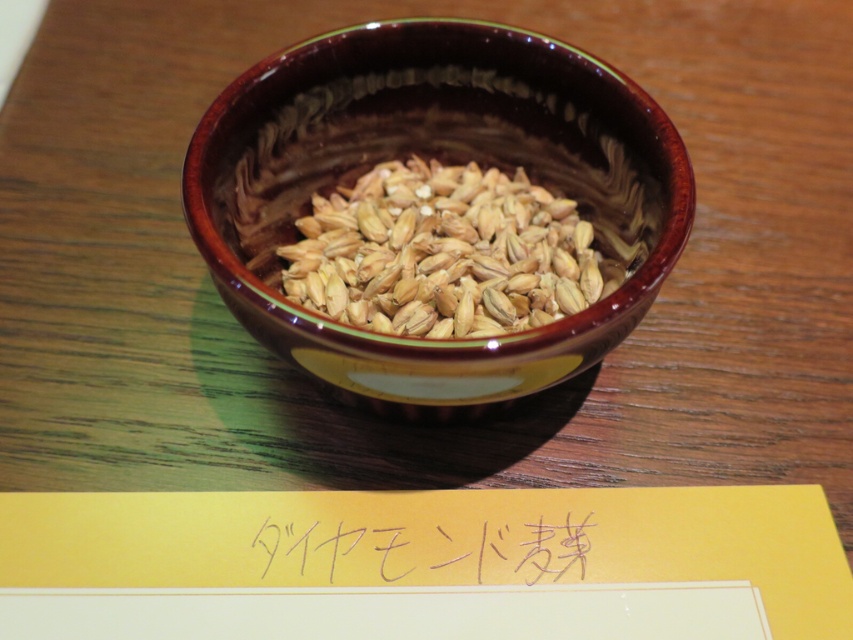
In the scene shown: You are a photographer trying to capture the brown glossy bowl at center. Your camera can focus on objects within 16 inches. Will the bowl be in focus?

The brown glossy bowl at center is 16.67 inches from the camera, which is beyond the 16 inches focus range. Therefore, the bowl will not be in focus.

You are organizing a display and need to place a label under an item. The scene shows a brown glossy bowl at center and a handwritten paper at center. Which object should the label be placed under?

The label should be placed under the handwritten paper at center because the brown glossy bowl at center is above it, indicating the paper is already positioned beneath the bowl.